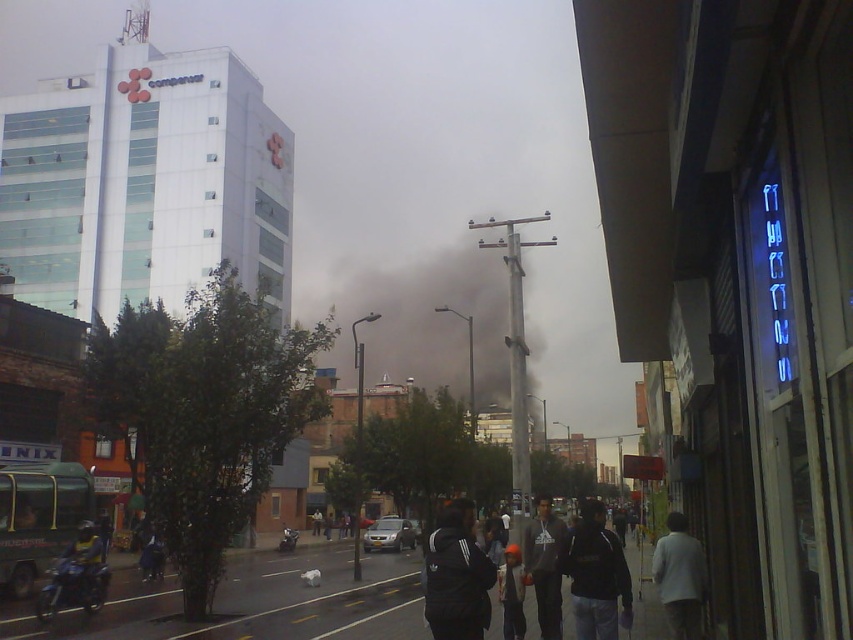
You are a pedestrian standing on the street and see the white matte jacket at lower right and the dark gray hoodie at center. Which clothing item is closer to you?

The white matte jacket at lower right is closer to you because it is in front of the dark gray hoodie at center.

You are a pedestrian standing on the street and see the black smoke at center and the white matte jacket at lower right. Which object is higher in the image?

The black smoke at center is higher than the white matte jacket at lower right because it is positioned above it.

You are a delivery person carrying a package that requires a 24 inch clearance between two people to pass through. You see the black matte jacket at lower center and the dark gray hoodie at center. Can you fit through the space between them?

The distance between the black matte jacket at lower center and the dark gray hoodie at center is 24.28 inches, so yes, the delivery person can fit through the space between them since it meets the required clearance of 24 inches.